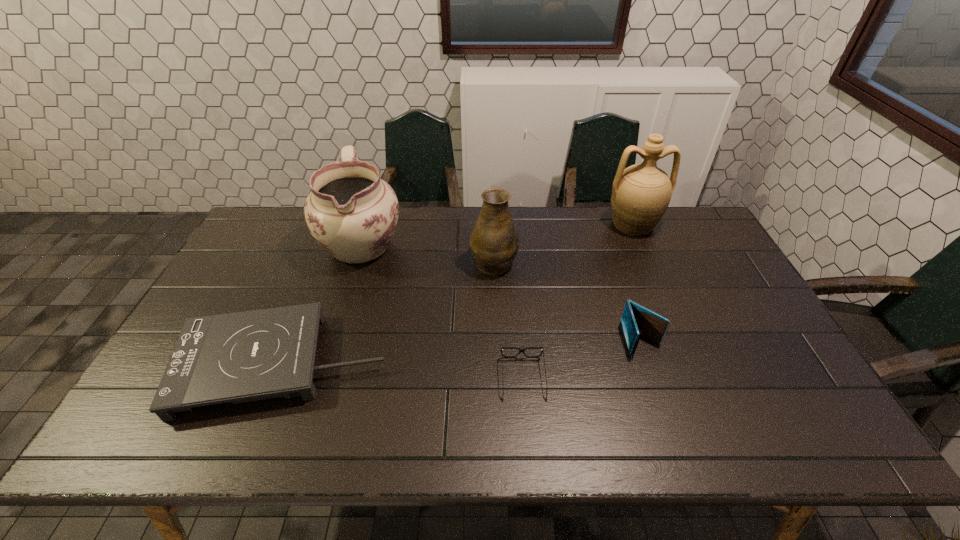
At what (x,y) coordinates should I click in order to perform the action: click on free location located on the handle side of the second pitcher from left to right. Please return your answer as a coordinate pair (x, y). The height and width of the screenshot is (540, 960). Looking at the image, I should click on (492, 227).

Locate an element on the screen. Image resolution: width=960 pixels, height=540 pixels. vacant region located 0.160m on the exterior surface of the third shortest object is located at coordinates (666, 413).

At what (x,y) coordinates should I click in order to perform the action: click on blank space located 0.130m on the back of the hotplate. Please return your answer as a coordinate pair (x, y). The width and height of the screenshot is (960, 540). Looking at the image, I should click on (314, 284).

Where is `free space located with the lenses facing outward on the spectacles`? free space located with the lenses facing outward on the spectacles is located at coordinates (x=527, y=434).

The width and height of the screenshot is (960, 540). Find the location of `object that is positioned at the near edge`. object that is positioned at the near edge is located at coordinates (247, 356).

The width and height of the screenshot is (960, 540). What are the coordinates of `object present at the left edge` in the screenshot? It's located at (247, 356).

Locate an element on the screen. Image resolution: width=960 pixels, height=540 pixels. object at the right edge is located at coordinates (641, 193).

Locate an element on the screen. The height and width of the screenshot is (540, 960). object that is at the near left corner is located at coordinates (247, 356).

You are a GUI agent. You are given a task and a screenshot of the screen. Output one action in this format:
    pyautogui.click(x=<x>, y=<y>)
    Task: Click on the object located at the far right corner
    This screenshot has width=960, height=540.
    Given the screenshot: What is the action you would take?
    pyautogui.click(x=641, y=193)

In the image, there is a desktop. Identify the location of free space at the far edge. The width and height of the screenshot is (960, 540). (584, 245).